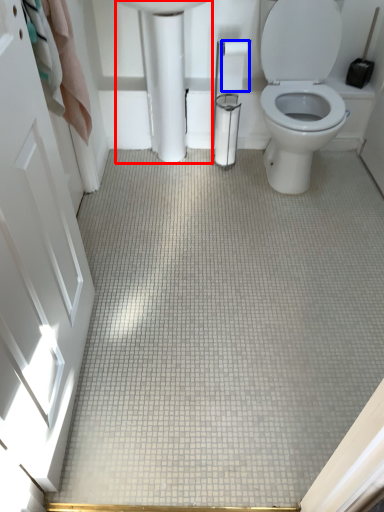
Question: Which object appears farthest to the camera in this image, porcelain (highlighted by a red box) or toilet paper (highlighted by a blue box)?

Choices:
 (A) porcelain
 (B) toilet paper

Answer: (B)